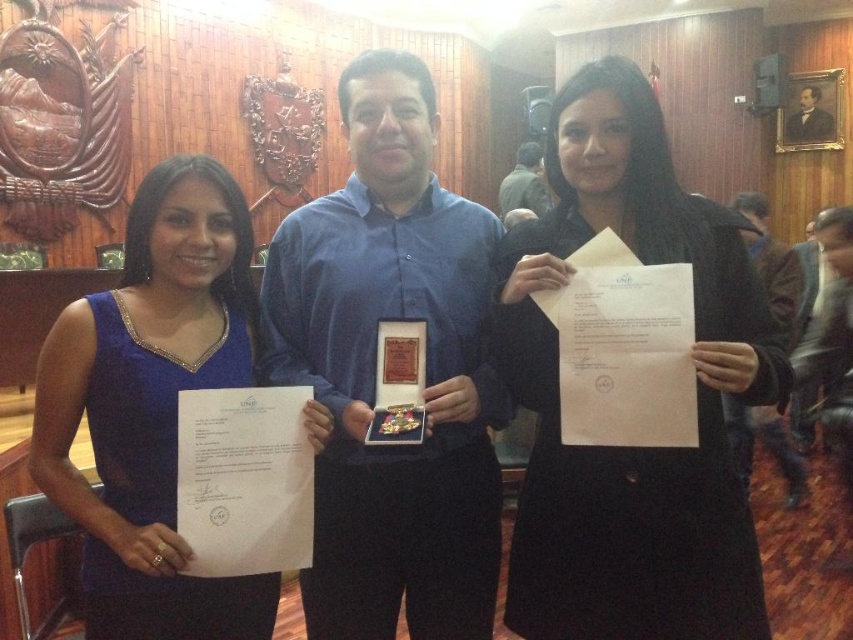
Question: Can you confirm if blue shirt at center is thinner than black matte coat at center?

Choices:
 (A) no
 (B) yes

Answer: (A)

Question: Which object is positioned closest to the brown leather jacket at right?

Choices:
 (A) brown wooden portrait at upper right
 (B) blue satin dress at left

Answer: (B)

Question: Does blue shirt at center have a greater width compared to blue satin dress at left?

Choices:
 (A) no
 (B) yes

Answer: (A)

Question: Is blue shirt at center thinner than green fabric shirt at center?

Choices:
 (A) yes
 (B) no

Answer: (B)

Question: Which of the following is the closest to the observer?

Choices:
 (A) (548, 144)
 (B) (177, 362)
 (C) (543, 186)
 (D) (822, 128)

Answer: (B)

Question: Which point is farther to the camera?

Choices:
 (A) (741, 406)
 (B) (160, 460)

Answer: (A)